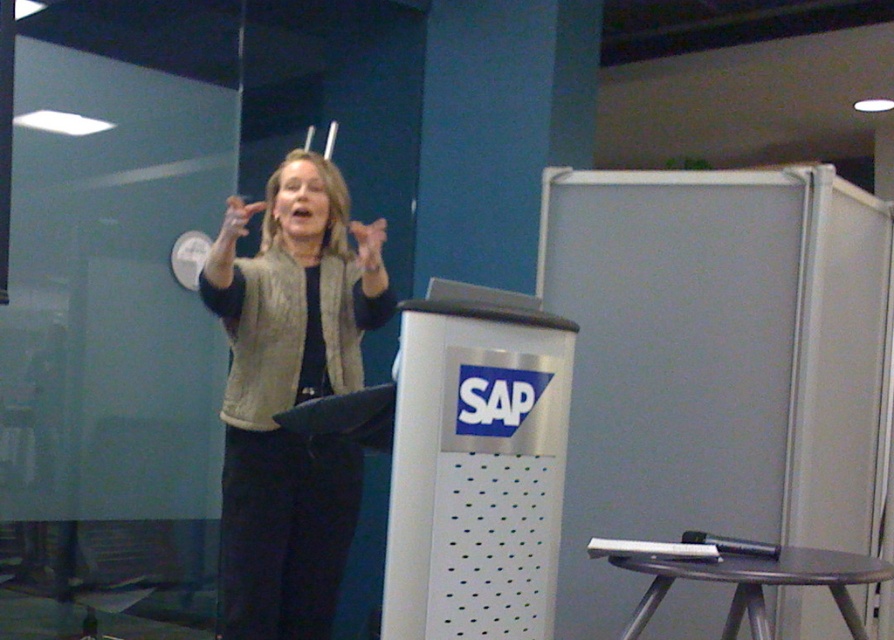
Can you confirm if metallic stool at lower right is positioned below pink matte hand at center?

Yes.

Does point (648, 554) lie behind point (361, 243)?

No, (648, 554) is in front of (361, 243).

What do you see at coordinates (756, 582) in the screenshot? I see `metallic stool at lower right` at bounding box center [756, 582].

In order to click on metallic stool at lower right in this screenshot , I will do `click(756, 582)`.

Which is more to the right, light beige vest at center or matte beige hand at upper center?

light beige vest at center

Find the location of a particular element. light beige vest at center is located at coordinates (288, 404).

How distant is metallic stool at lower right from matte beige hand at upper center?

A distance of 4.83 feet exists between metallic stool at lower right and matte beige hand at upper center.

Can you confirm if metallic stool at lower right is smaller than matte beige hand at upper center?

Actually, metallic stool at lower right might be larger than matte beige hand at upper center.

Find the location of `metallic stool at lower right`. metallic stool at lower right is located at coordinates (756, 582).